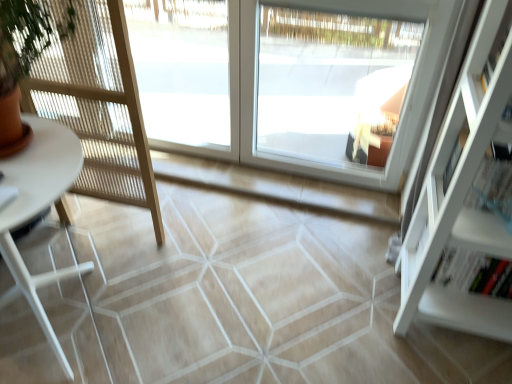
Locate an element on the screen. This screenshot has width=512, height=384. vacant space positioned to the left of white matte shelf at right is located at coordinates (356, 312).